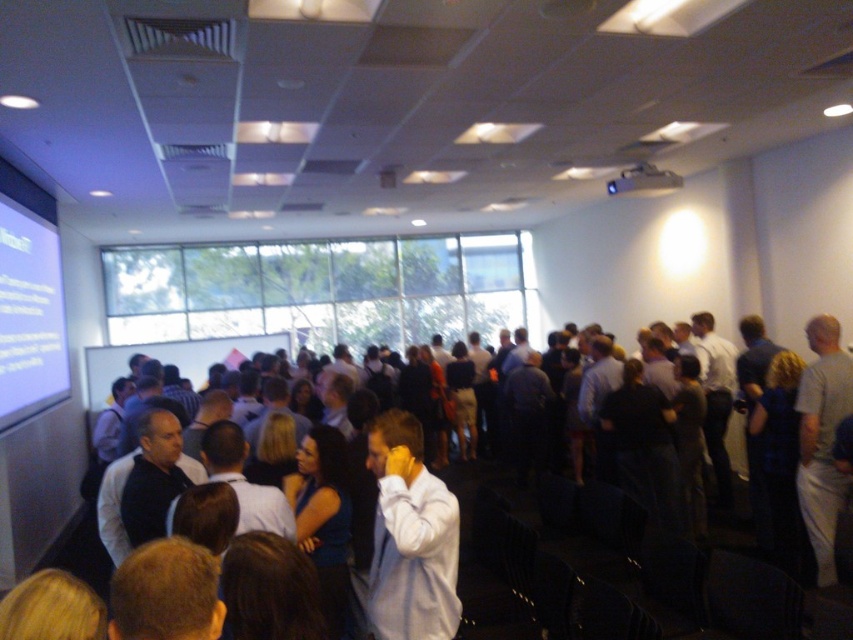
Question: Is white matte shirt at center further to the viewer compared to black plastic projector at upper center?

Choices:
 (A) no
 (B) yes

Answer: (A)

Question: Based on their relative distances, which object is farther from the white glossy projection screen at upper left?

Choices:
 (A) white matte shirt at center
 (B) black plastic projector at upper center

Answer: (B)

Question: Which is farther from the white glossy projection screen at upper left?

Choices:
 (A) white matte shirt at center
 (B) black plastic projector at upper center

Answer: (B)

Question: Is white glossy projection screen at upper left thinner than black plastic projector at upper center?

Choices:
 (A) no
 (B) yes

Answer: (A)

Question: Which is farther from the white glossy projection screen at upper left?

Choices:
 (A) black plastic projector at upper center
 (B) white matte shirt at center

Answer: (A)

Question: Can you confirm if white matte shirt at center is positioned below white glossy projection screen at upper left?

Choices:
 (A) no
 (B) yes

Answer: (B)